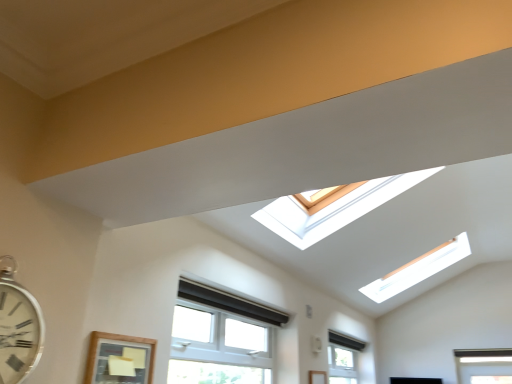
Question: From the image's perspective, is white plastic window at lower center, which is the 2th window in back-to-front order, located above or below white metallic clock at left?

Choices:
 (A) above
 (B) below

Answer: (B)

Question: Considering the positions of white plastic window at lower center, placed as the second window when sorted from left to right, and white metallic clock at left in the image, is white plastic window at lower center, placed as the second window when sorted from left to right, bigger or smaller than white metallic clock at left?

Choices:
 (A) small
 (B) big

Answer: (B)

Question: Based on their relative distances, which object is nearer to the white plastic window at lower center, placed as the second window when sorted from left to right?

Choices:
 (A) wooden-framed window at lower left, the third window when ordered from back to front
 (B) clear glass window at lower center, the 3th window viewed from the front
 (C) white metallic clock at left

Answer: (A)

Question: Which object is positioned closest to the white plastic window at lower center, the second window positioned from the front?

Choices:
 (A) wooden-framed window at lower left, the third window when ordered from back to front
 (B) white metallic clock at left
 (C) clear glass window at lower center, which is counted as the first window, starting from the back

Answer: (A)